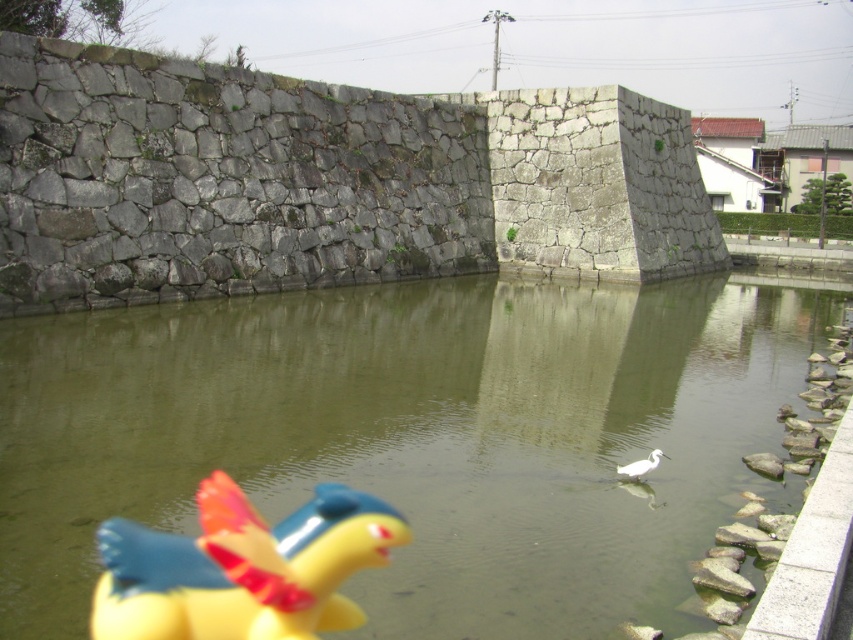
You are standing in the scene and want to locate the greenish water at center. What are the coordinates where you can find it?

The greenish water at center can be found at coordinates point (x=415, y=438).

You are standing at the point labeled as point [415,438] in the image. What do you see around you?

You are standing in the greenish water at center, as point [415,438] corresponds to greenish water at center.